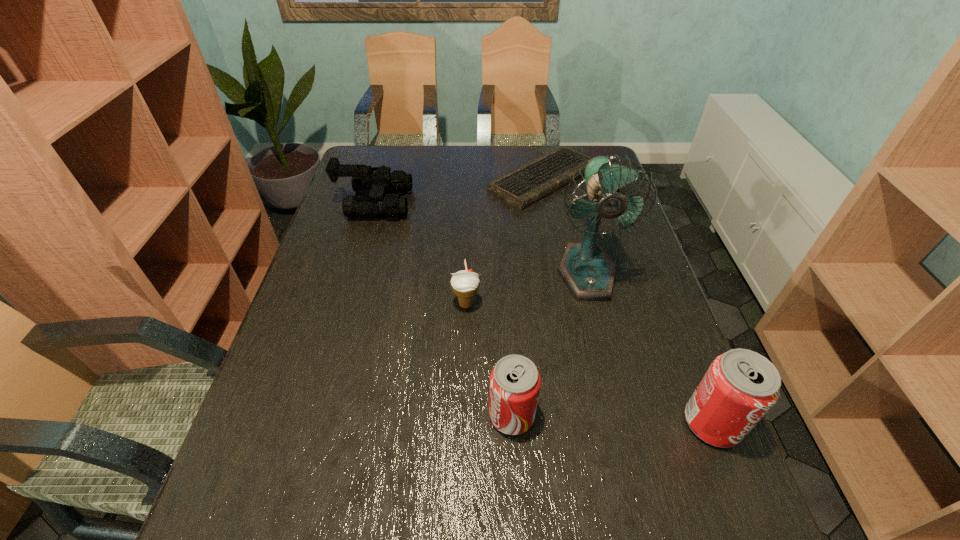
Locate an element on the screen. This screenshot has height=540, width=960. free space located 0.120m on the front lenses of the binoculars is located at coordinates (447, 204).

You are a GUI agent. You are given a task and a screenshot of the screen. Output one action in this format:
    pyautogui.click(x=<x>, y=<y>)
    Task: Click on the blank space located in front of the tallest object where the wind blows
    This screenshot has height=540, width=960.
    Given the screenshot: What is the action you would take?
    pyautogui.click(x=620, y=409)

This screenshot has width=960, height=540. In order to click on vacant space located 0.370m on the left of the icecream in this screenshot , I will do `click(306, 304)`.

The height and width of the screenshot is (540, 960). Identify the location of object located at the far edge. (522, 187).

The width and height of the screenshot is (960, 540). What are the coordinates of `object located at the near edge` in the screenshot? It's located at (740, 386).

Locate an element on the screen. This screenshot has height=540, width=960. object present at the left edge is located at coordinates (364, 180).

Locate an element on the screen. Image resolution: width=960 pixels, height=540 pixels. soda can at the right edge is located at coordinates (740, 386).

Identify the location of computer keyboard positioned at the right edge. (522, 187).

What are the coordinates of `fan that is at the right edge` in the screenshot? It's located at (589, 273).

You are a GUI agent. You are given a task and a screenshot of the screen. Output one action in this format:
    pyautogui.click(x=<x>, y=<y>)
    Task: Click on the object present at the far right corner
    The height and width of the screenshot is (540, 960).
    Given the screenshot: What is the action you would take?
    pyautogui.click(x=522, y=187)